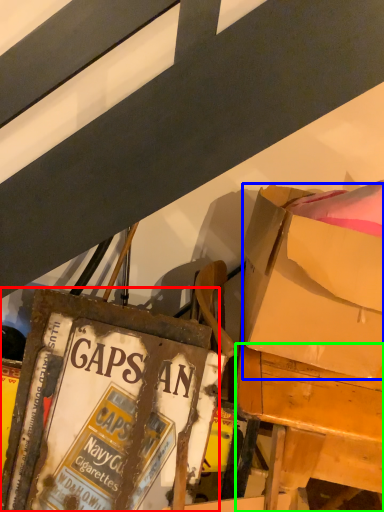
Question: Considering the real-world distances, which object is closest to paperback book (highlighted by a red box)? box (highlighted by a blue box) or desk (highlighted by a green box).

Choices:
 (A) box
 (B) desk

Answer: (B)